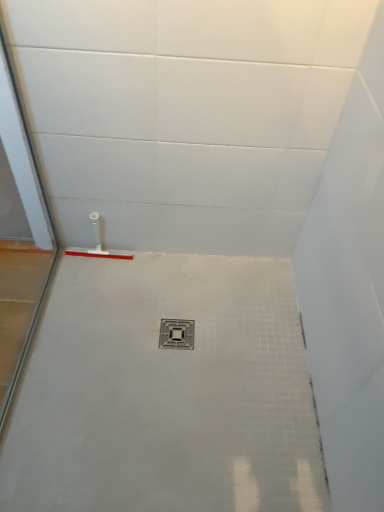
Question: Is white plastic squeegee at left inside or outside of metallic gray drain at center?

Choices:
 (A) outside
 (B) inside

Answer: (A)

Question: Based on their positions, is white plastic squeegee at left located to the left or right of metallic gray drain at center?

Choices:
 (A) right
 (B) left

Answer: (B)

Question: Is point (81, 250) positioned closer to the camera than point (160, 336)?

Choices:
 (A) closer
 (B) farther

Answer: (B)

Question: In the image, is metallic gray drain at center positioned in front of or behind white plastic squeegee at left?

Choices:
 (A) front
 (B) behind

Answer: (A)

Question: From a real-world perspective, is metallic gray drain at center positioned above or below white plastic squeegee at left?

Choices:
 (A) below
 (B) above

Answer: (A)

Question: Based on their positions, is metallic gray drain at center located to the left or right of white plastic squeegee at left?

Choices:
 (A) left
 (B) right

Answer: (B)

Question: Is metallic gray drain at center wider or thinner than white plastic squeegee at left?

Choices:
 (A) wide
 (B) thin

Answer: (A)